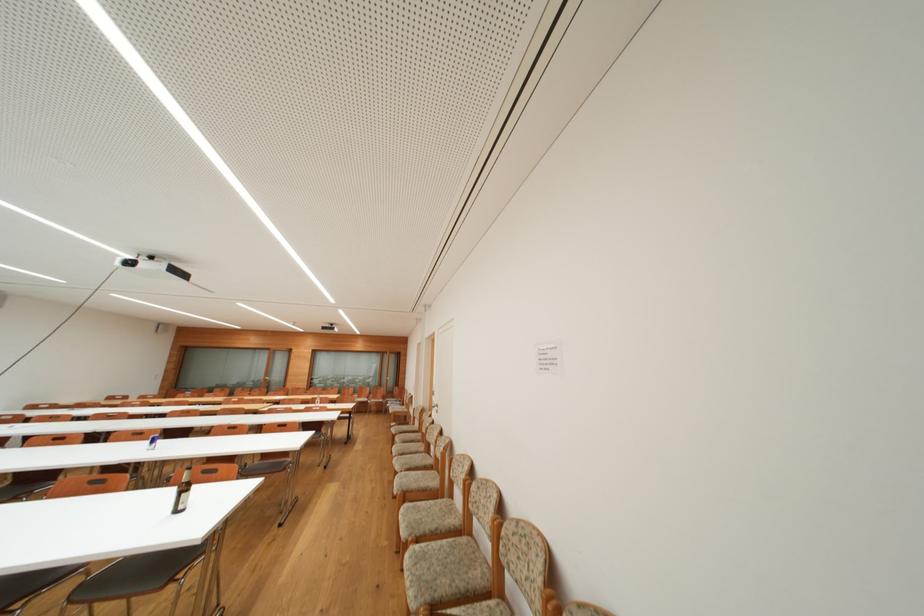
Describe the element at coordinates (181, 492) in the screenshot. I see `the brown glass bottle` at that location.